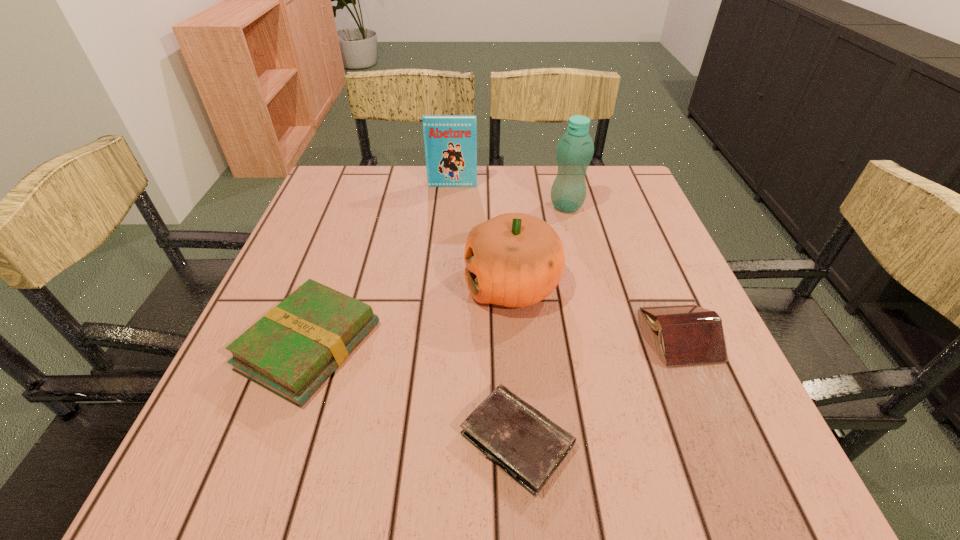
At what (x,y) coordinates should I click in order to perform the action: click on the second farthest object. Please return your answer as a coordinate pair (x, y). Looking at the image, I should click on (575, 149).

Image resolution: width=960 pixels, height=540 pixels. Identify the location of the tallest object. (575, 149).

Locate an element on the screen. Image resolution: width=960 pixels, height=540 pixels. the farthest object is located at coordinates (450, 141).

The image size is (960, 540). What are the coordinates of `the second book from left to right` in the screenshot? It's located at (450, 141).

Locate an element on the screen. pumpkin is located at coordinates (514, 260).

The width and height of the screenshot is (960, 540). In order to click on the leftmost object in this screenshot , I will do `click(293, 349)`.

You are a GUI agent. You are given a task and a screenshot of the screen. Output one action in this format:
    pyautogui.click(x=<x>, y=<y>)
    Task: Click on the rightmost object
    This screenshot has height=540, width=960.
    Given the screenshot: What is the action you would take?
    pyautogui.click(x=688, y=334)

Locate an element on the screen. The width and height of the screenshot is (960, 540). diary is located at coordinates (527, 445).

Locate an element on the screen. The width and height of the screenshot is (960, 540). vacant position located 0.060m at the front cap of the water bottle is located at coordinates [x=526, y=206].

Where is `vacant area situated at the front cap of the water bottle`? vacant area situated at the front cap of the water bottle is located at coordinates (473, 206).